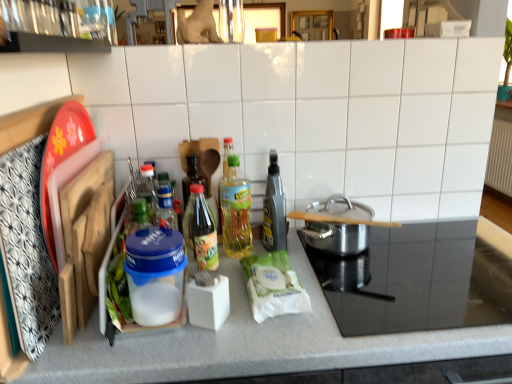
This screenshot has width=512, height=384. In order to click on free space above stainless steel pot at right, placed as the first appliance when sorted from right to left (from a real-world perspective) in this screenshot , I will do `click(451, 259)`.